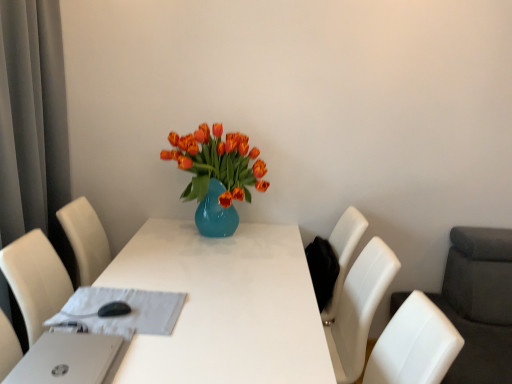
Question: Considering the positions of point (206, 377) and point (181, 157), is point (206, 377) closer or farther from the camera than point (181, 157)?

Choices:
 (A) farther
 (B) closer

Answer: (B)

Question: Looking at the image, does white glossy table at center seem bigger or smaller compared to matte blue vase at center?

Choices:
 (A) big
 (B) small

Answer: (A)

Question: Which object is the closest to the white glossy table at center?

Choices:
 (A) white plastic laptop at lower left
 (B) matte blue vase at center
 (C) white fabric at center
 (D) gray fabric curtain at left

Answer: (C)

Question: Estimate the real-world distances between objects in this image. Which object is farther from the white plastic laptop at lower left?

Choices:
 (A) matte blue vase at center
 (B) white fabric at center
 (C) gray fabric curtain at left
 (D) white glossy table at center

Answer: (C)